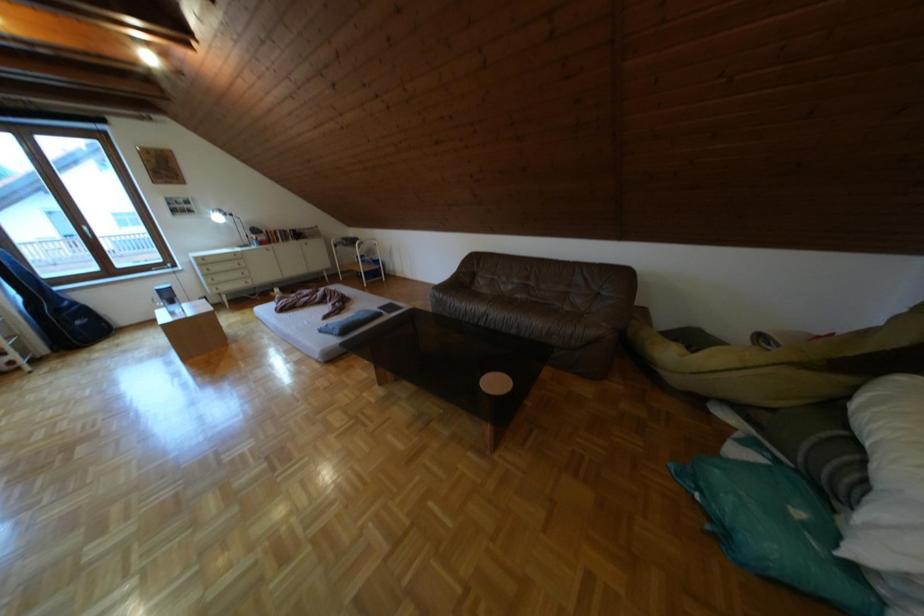
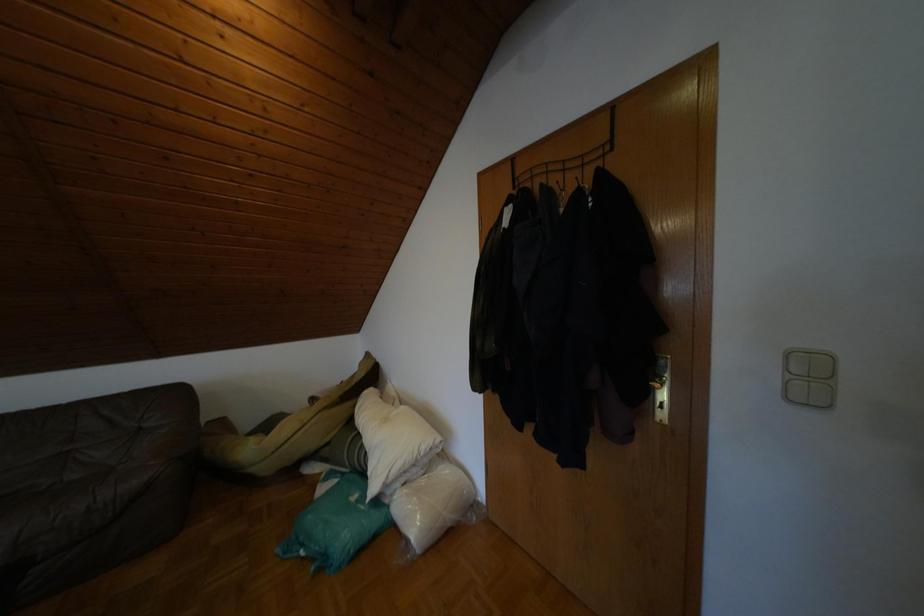
Question: The camera is either moving clockwise (left) or counter-clockwise (right) around the object. The first image is from the beginning of the video and the second image is from the end. Is the camera moving left or right when shooting the video?

Choices:
 (A) Left
 (B) Right

Answer: (A)